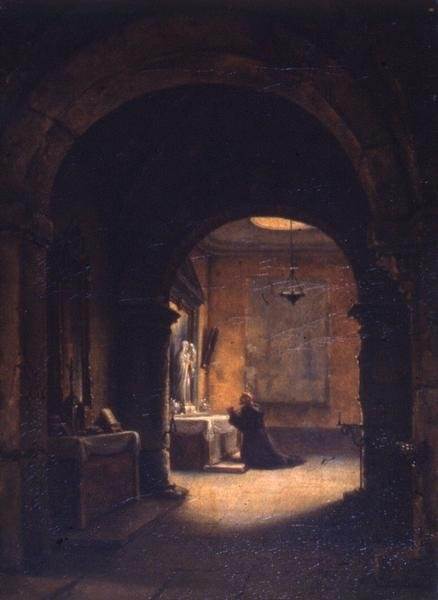
Where is `chandelier`? The height and width of the screenshot is (600, 438). chandelier is located at coordinates (287, 297).